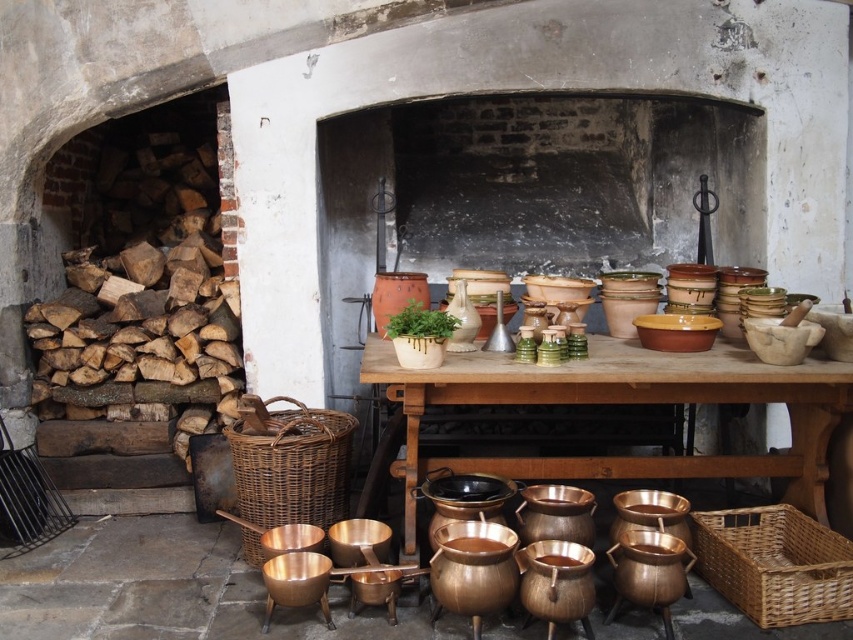
Question: Which of the following is the farthest from the observer?

Choices:
 (A) (309, 483)
 (B) (772, 577)

Answer: (A)

Question: Which is farther from the matte ceramic table at center?

Choices:
 (A) woven brown basket at lower center
 (B) woven brown basket at lower right

Answer: (A)

Question: Considering the relative positions of woven brown basket at lower right and woven brown basket at lower center in the image provided, where is woven brown basket at lower right located with respect to woven brown basket at lower center?

Choices:
 (A) left
 (B) right

Answer: (B)

Question: Which point is farther to the camera?

Choices:
 (A) woven brown basket at lower right
 (B) matte ceramic table at center

Answer: (A)

Question: Can you confirm if woven brown basket at lower right is wider than woven brown basket at lower center?

Choices:
 (A) yes
 (B) no

Answer: (B)

Question: Is woven brown basket at lower right positioned before woven brown basket at lower center?

Choices:
 (A) no
 (B) yes

Answer: (B)